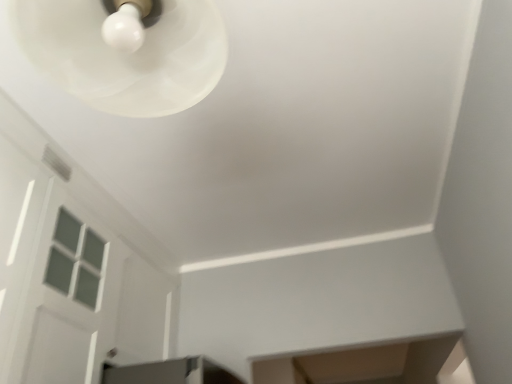
What do you see at coordinates (125, 55) in the screenshot?
I see `white matte lampshade at upper left` at bounding box center [125, 55].

Find the location of `white matte lampshade at upper left`. white matte lampshade at upper left is located at coordinates (125, 55).

Where is `white matte lampshade at upper left`? white matte lampshade at upper left is located at coordinates (125, 55).